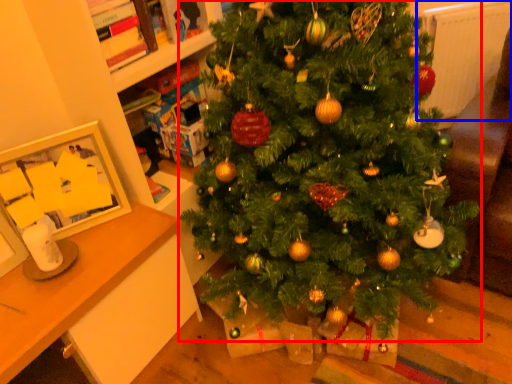
Question: Which of the following is the closest to the observer, christmas tree (highlighted by a red box) or radiator (highlighted by a blue box)?

Choices:
 (A) christmas tree
 (B) radiator

Answer: (A)